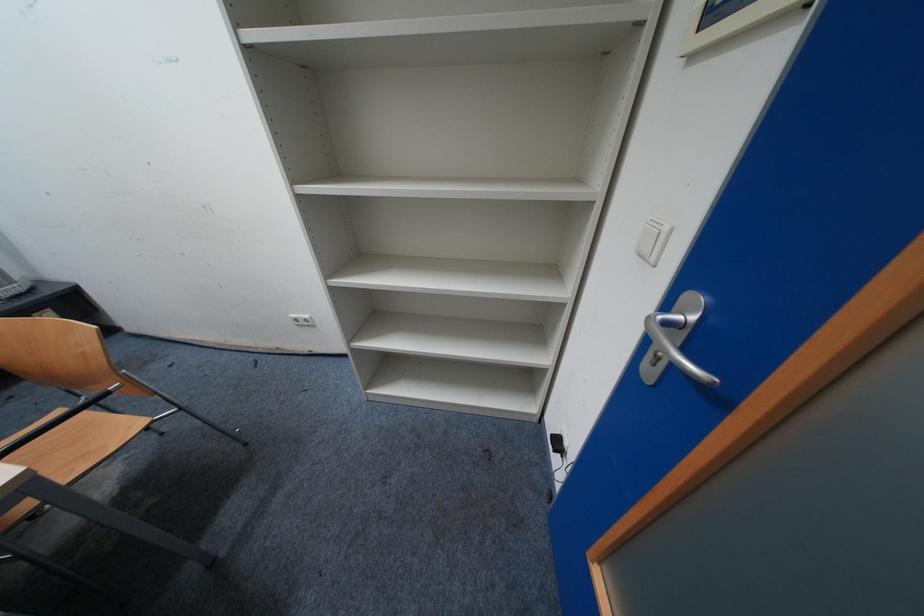
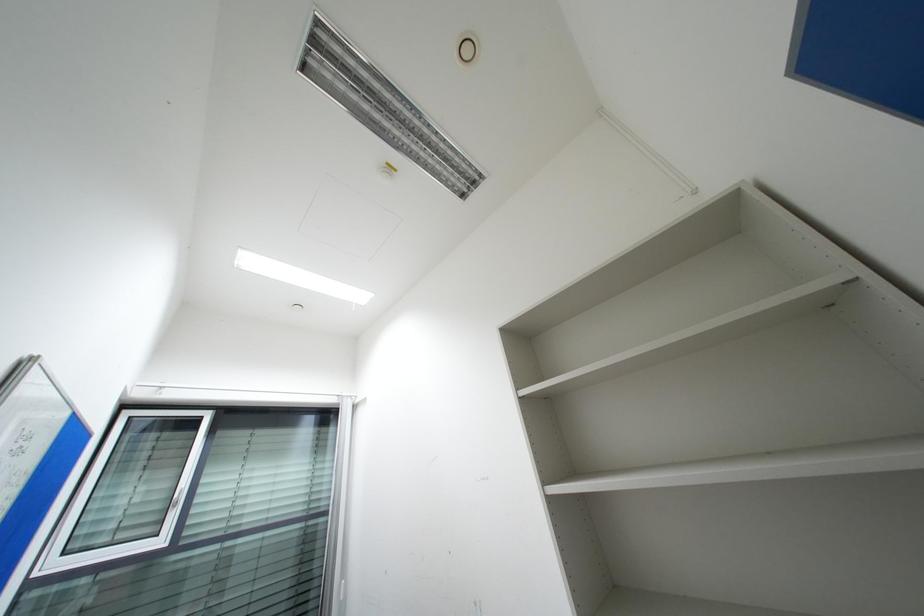
First-person continuous shooting, in which direction is the camera rotating?

The camera rotated toward left-up.